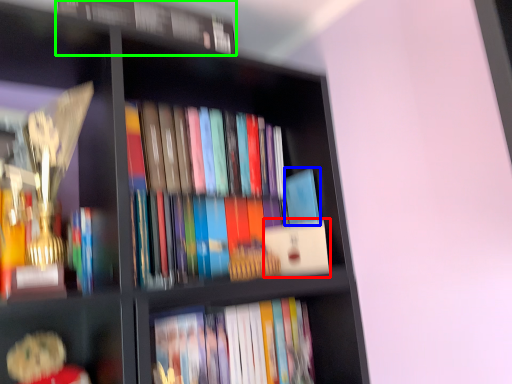
Question: Which object is positioned farthest from paperback book (highlighted by a red box)? Select from paperback book (highlighted by a blue box) and book (highlighted by a green box).

Choices:
 (A) paperback book
 (B) book

Answer: (B)